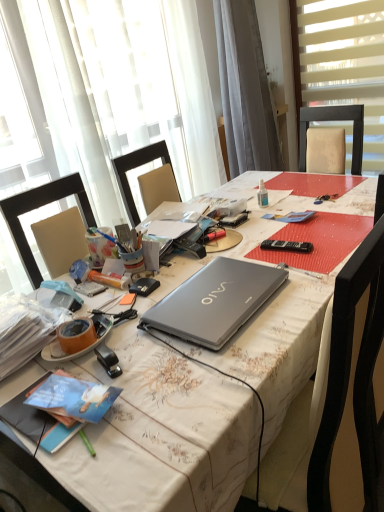
The height and width of the screenshot is (512, 384). Identify the location of vacant space in front of clear plastic bottle at center. 270,217.